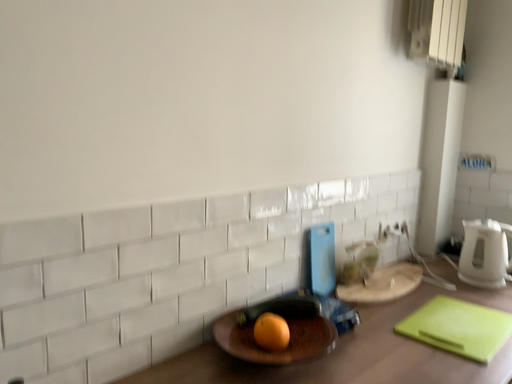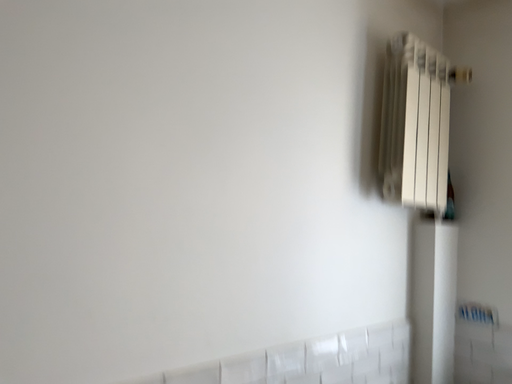
Question: Which way did the camera rotate in the video?

Choices:
 (A) rotated downward
 (B) rotated upward

Answer: (B)